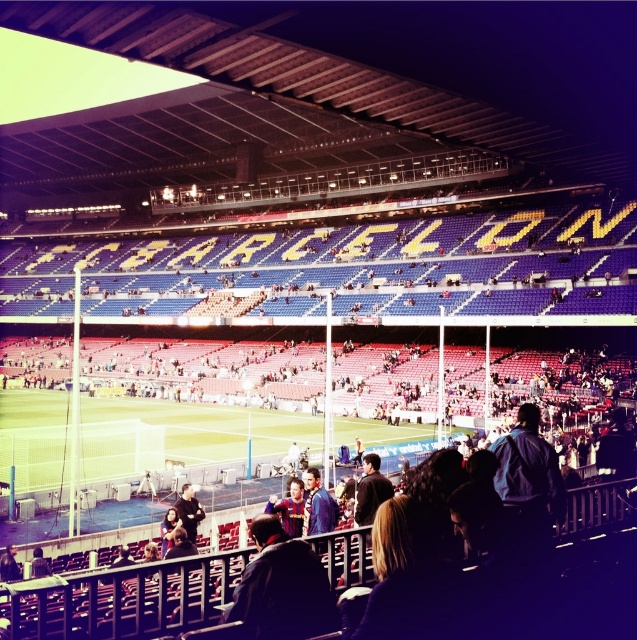
Can you confirm if blue fabric jacket at center is positioned below dark blue jacket at lower center?

No.

Who is taller, blue fabric jacket at center or dark blue jacket at lower center?

dark blue jacket at lower center is taller.

Is point (308, 496) more distant than point (183, 484)?

That is False.

Where is `blue fabric jacket at center`? The width and height of the screenshot is (637, 640). blue fabric jacket at center is located at coordinates (317, 506).